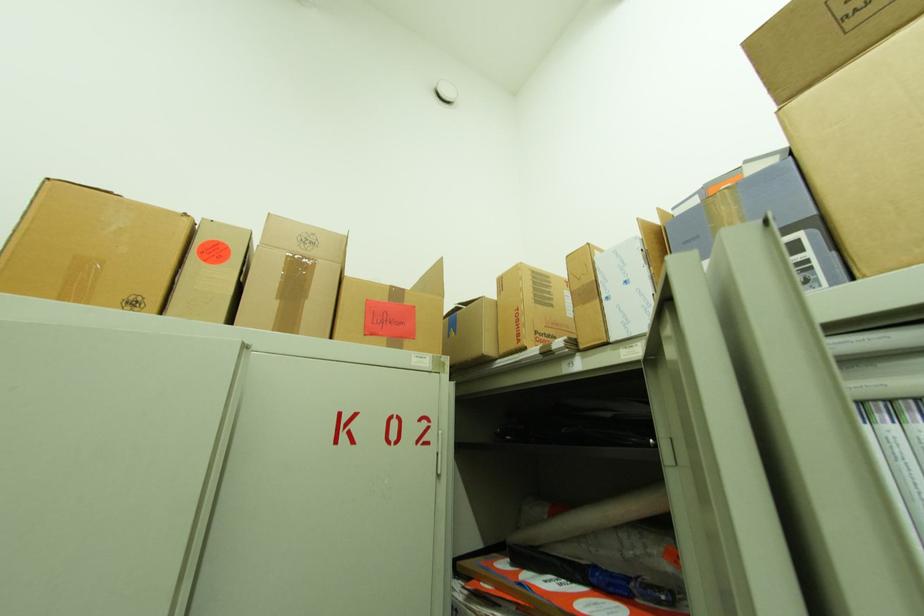
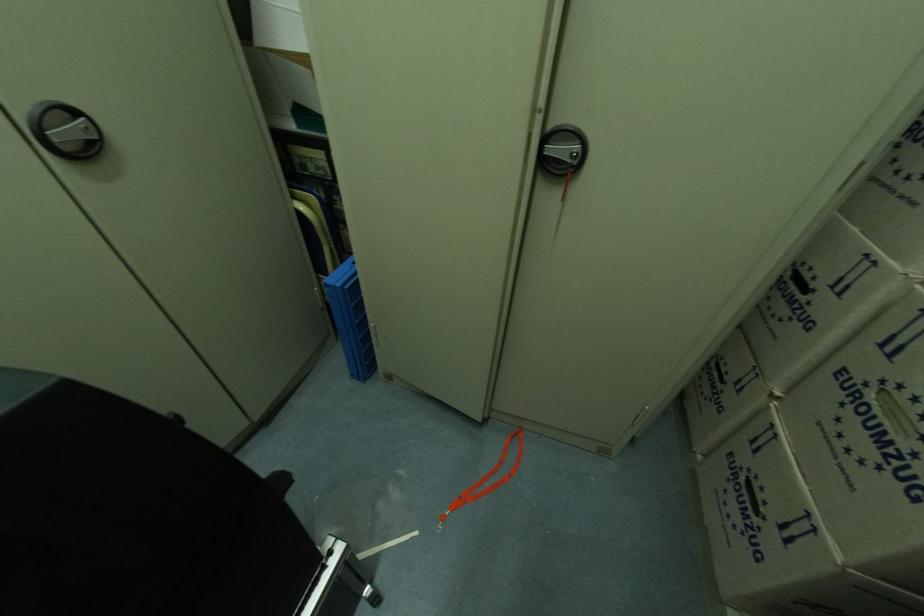
First-person continuous shooting, in which direction is the camera rotating?

The camera's rotation is toward left-down.